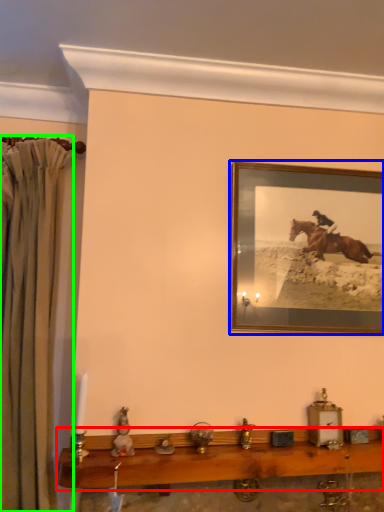
Question: Which object is the closest to the table (highlighted by a red box)? Choose among these: picture frame (highlighted by a blue box) or curtain (highlighted by a green box).

Choices:
 (A) picture frame
 (B) curtain

Answer: (B)